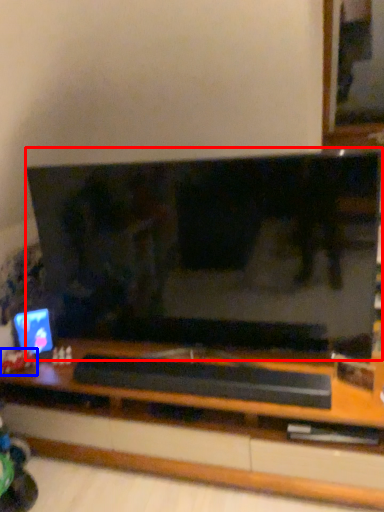
Question: Which of the following is the farthest to the observer, television (highlighted by a red box) or toy (highlighted by a blue box)?

Choices:
 (A) television
 (B) toy

Answer: (B)